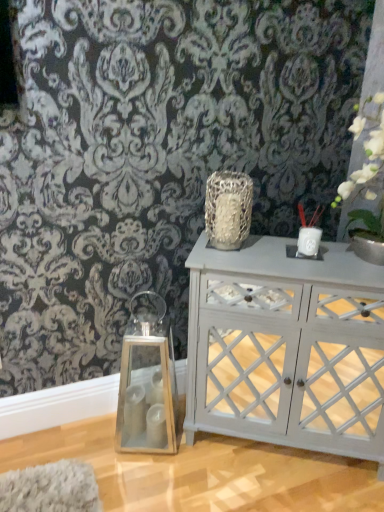
What do you see at coordinates (308, 242) in the screenshot? I see `white ceramic candle holder at upper right, which ranks as the second candle holder in top-to-bottom order` at bounding box center [308, 242].

Describe the element at coordinates (228, 209) in the screenshot. I see `textured silver vase at center` at that location.

Locate an element on the screen. white painted wood cabinet at center is located at coordinates (287, 348).

Would you say textured silver vase at center is outside white painted wood cabinet at center?

Yes.

In the scene shown: Is textured silver vase at center positioned with its back to white painted wood cabinet at center?

No, textured silver vase at center is not facing away from white painted wood cabinet at center.

Can you tell me how much textured silver vase at center and white painted wood cabinet at center differ in facing direction?

The angle between the facing direction of textured silver vase at center and the facing direction of white painted wood cabinet at center is 0.000772 degrees.

Which of these two, textured silver vase at center or white painted wood cabinet at center, is bigger?

white painted wood cabinet at center.

From a real-world perspective, is white ceramic candle holder at upper right, acting as the 2th candle holder starting from the bottom, physically below white painted wood cabinet at center?

Actually, white ceramic candle holder at upper right, acting as the 2th candle holder starting from the bottom, is physically above white painted wood cabinet at center in the real world.

Is white ceramic candle holder at upper right, positioned as the 2th candle holder in right-to-left order, to the left or to the right of white painted wood cabinet at center in the image?

white ceramic candle holder at upper right, positioned as the 2th candle holder in right-to-left order, is positioned on white painted wood cabinet at center's right side.

Considering the relative sizes of white ceramic candle holder at upper right, positioned as the 2th candle holder in right-to-left order, and white painted wood cabinet at center in the image provided, is white ceramic candle holder at upper right, positioned as the 2th candle holder in right-to-left order, wider than white painted wood cabinet at center?

Incorrect, the width of white ceramic candle holder at upper right, positioned as the 2th candle holder in right-to-left order, does not surpass that of white painted wood cabinet at center.

From the image's perspective, is white ceramic candle holder at upper right, arranged as the second candle holder when viewed from the left, under white painted wood cabinet at center?

No.

Is white ceramic vase at upper right, the third candle holder positioned from the left, not within clear glass lantern at left, the third candle holder from the top?

Yes, white ceramic vase at upper right, the third candle holder positioned from the left, is located beyond the bounds of clear glass lantern at left, the third candle holder from the top.

How different are the orientations of white ceramic vase at upper right, arranged as the 3th candle holder when ordered from the bottom, and clear glass lantern at left, the 1th candle holder from the left, in degrees?

They differ by 4.92 degrees in their facing directions.

Does white ceramic vase at upper right, positioned as the first candle holder in right-to-left order, have a lesser height compared to clear glass lantern at left, marked as the 3th candle holder in a right-to-left arrangement?

Indeed, white ceramic vase at upper right, positioned as the first candle holder in right-to-left order, has a lesser height compared to clear glass lantern at left, marked as the 3th candle holder in a right-to-left arrangement.

Is white ceramic vase at upper right, the third candle holder positioned from the left, in contact with clear glass lantern at left, which is counted as the first candle holder, starting from the bottom?

No, white ceramic vase at upper right, the third candle holder positioned from the left, is not beside clear glass lantern at left, which is counted as the first candle holder, starting from the bottom.

From a real-world perspective, does white ceramic vase at upper right, the third candle holder positioned from the left, sit lower than white painted wood cabinet at center?

No, from a real-world perspective, white ceramic vase at upper right, the third candle holder positioned from the left, is not below white painted wood cabinet at center.

Could white painted wood cabinet at center be considered to be inside white ceramic vase at upper right, arranged as the 3th candle holder when ordered from the bottom?

That's incorrect, white painted wood cabinet at center is not inside white ceramic vase at upper right, arranged as the 3th candle holder when ordered from the bottom.

Considering the relative positions of white ceramic vase at upper right, arranged as the first candle holder when viewed from the top, and white painted wood cabinet at center in the image provided, is white ceramic vase at upper right, arranged as the first candle holder when viewed from the top, to the right of white painted wood cabinet at center from the viewer's perspective?

Yes.

Is textured silver vase at center in front of or behind clear glass lantern at left, which is counted as the first candle holder, starting from the bottom, in the image?

textured silver vase at center is in front of clear glass lantern at left, which is counted as the first candle holder, starting from the bottom.

Is textured silver vase at center to the left or to the right of clear glass lantern at left, marked as the 3th candle holder in a right-to-left arrangement, in the image?

Based on their positions, textured silver vase at center is located to the right of clear glass lantern at left, marked as the 3th candle holder in a right-to-left arrangement.

Is textured silver vase at center with clear glass lantern at left, which is counted as the first candle holder, starting from the bottom?

textured silver vase at center and clear glass lantern at left, which is counted as the first candle holder, starting from the bottom, are not in contact.

Who is bigger, textured silver vase at center or clear glass lantern at left, marked as the 3th candle holder in a right-to-left arrangement?

Bigger between the two is clear glass lantern at left, marked as the 3th candle holder in a right-to-left arrangement.

Does point (315, 241) appear closer or farther from the camera than point (313, 238)?

Point (315, 241) is positioned farther from the camera compared to point (313, 238).

Is white ceramic vase at upper right, arranged as the first candle holder when viewed from the top, turned away from white ceramic candle holder at upper right, acting as the 2th candle holder starting from the bottom?

white ceramic vase at upper right, arranged as the first candle holder when viewed from the top, is not turned away from white ceramic candle holder at upper right, acting as the 2th candle holder starting from the bottom.

Which object is positioned more to the left, white ceramic vase at upper right, arranged as the 3th candle holder when ordered from the bottom, or white ceramic candle holder at upper right, which ranks as the second candle holder in top-to-bottom order?

white ceramic candle holder at upper right, which ranks as the second candle holder in top-to-bottom order.

Is white ceramic candle holder at upper right, arranged as the second candle holder when viewed from the left, surrounded by white ceramic vase at upper right, arranged as the 3th candle holder when ordered from the bottom?

Actually, white ceramic candle holder at upper right, arranged as the second candle holder when viewed from the left, is outside white ceramic vase at upper right, arranged as the 3th candle holder when ordered from the bottom.

Is white ceramic candle holder at upper right, positioned as the 2th candle holder in right-to-left order, located outside white ceramic vase at upper right, arranged as the first candle holder when viewed from the top?

Yes, white ceramic candle holder at upper right, positioned as the 2th candle holder in right-to-left order, is not within white ceramic vase at upper right, arranged as the first candle holder when viewed from the top.

In the scene shown: Considering the sizes of objects white ceramic candle holder at upper right, positioned as the 2th candle holder in right-to-left order, and white ceramic vase at upper right, arranged as the 3th candle holder when ordered from the bottom, in the image provided, who is thinner, white ceramic candle holder at upper right, positioned as the 2th candle holder in right-to-left order, or white ceramic vase at upper right, arranged as the 3th candle holder when ordered from the bottom,?

Thinner between the two is white ceramic vase at upper right, arranged as the 3th candle holder when ordered from the bottom.

Does point (299, 242) come farther from viewer compared to point (314, 224)?

No, it is not.

Is white ceramic candle holder at upper right, positioned as the 2th candle holder in right-to-left order, closer to camera compared to white ceramic vase at upper right, the third candle holder positioned from the left?

Yes, white ceramic candle holder at upper right, positioned as the 2th candle holder in right-to-left order, is in front of white ceramic vase at upper right, the third candle holder positioned from the left.

The width and height of the screenshot is (384, 512). What are the coordinates of `vase above the white painted wood cabinet at center (from a real-world perspective)` in the screenshot? It's located at (228, 209).

Locate an element on the screen. The image size is (384, 512). nightstand located below the white ceramic candle holder at upper right, which ranks as the second candle holder in top-to-bottom order (from the image's perspective) is located at coordinates (287, 348).

Based on their spatial positions, is white matte vase at upper right or clear glass lantern at left, which is counted as the first candle holder, starting from the bottom, closer to white ceramic vase at upper right, arranged as the first candle holder when viewed from the top?

white matte vase at upper right is positioned closer to the anchor white ceramic vase at upper right, arranged as the first candle holder when viewed from the top.

Which object lies nearer to the anchor point textured silver vase at center, white painted wood cabinet at center or white matte vase at upper right?

The object closer to textured silver vase at center is white matte vase at upper right.

Based on the photo, when comparing their distances from white painted wood cabinet at center, does white matte vase at upper right or white ceramic vase at upper right, positioned as the first candle holder in right-to-left order, seem further?

white matte vase at upper right lies further to white painted wood cabinet at center than the other object.

Which object lies further to the anchor point white painted wood cabinet at center, white matte vase at upper right or white ceramic candle holder at upper right, acting as the 2th candle holder starting from the bottom?

The object further to white painted wood cabinet at center is white matte vase at upper right.

Considering their positions, is textured silver vase at center positioned closer to white ceramic vase at upper right, positioned as the first candle holder in right-to-left order, than white matte vase at upper right?

white matte vase at upper right lies closer to white ceramic vase at upper right, positioned as the first candle holder in right-to-left order, than the other object.

Based on their spatial positions, is white matte vase at upper right or textured silver vase at center closer to white ceramic vase at upper right, arranged as the 3th candle holder when ordered from the bottom?

white matte vase at upper right lies closer to white ceramic vase at upper right, arranged as the 3th candle holder when ordered from the bottom, than the other object.

Looking at the image, which one is located closer to clear glass lantern at left, which is counted as the first candle holder, starting from the bottom, white ceramic candle holder at upper right, arranged as the second candle holder when viewed from the left, or white matte vase at upper right?

white ceramic candle holder at upper right, arranged as the second candle holder when viewed from the left.

Considering their positions, is clear glass lantern at left, marked as the 3th candle holder in a right-to-left arrangement, positioned closer to white ceramic vase at upper right, arranged as the first candle holder when viewed from the top, than white ceramic candle holder at upper right, positioned as the 2th candle holder in right-to-left order?

Based on the image, white ceramic candle holder at upper right, positioned as the 2th candle holder in right-to-left order, appears to be nearer to white ceramic vase at upper right, arranged as the first candle holder when viewed from the top.

Find the location of `nightstand between clear glass lantern at left, marked as the 3th candle holder in a right-to-left arrangement, and white ceramic vase at upper right, arranged as the first candle holder when viewed from the top`. nightstand between clear glass lantern at left, marked as the 3th candle holder in a right-to-left arrangement, and white ceramic vase at upper right, arranged as the first candle holder when viewed from the top is located at coordinates (287, 348).

What are the coordinates of `nightstand between textured silver vase at center and clear glass lantern at left, the 1th candle holder from the left, vertically` in the screenshot? It's located at (287, 348).

This screenshot has width=384, height=512. In order to click on vase between white matte vase at upper right and white painted wood cabinet at center in the vertical direction in this screenshot , I will do `click(228, 209)`.

Image resolution: width=384 pixels, height=512 pixels. I want to click on candle holder between white ceramic vase at upper right, arranged as the 3th candle holder when ordered from the bottom, and white painted wood cabinet at center, in the vertical direction, so click(x=308, y=242).